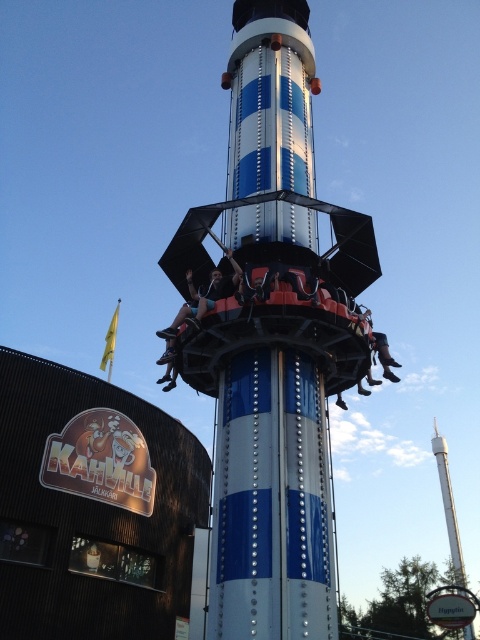
Question: Can you confirm if blue metallic tower at center is positioned to the left of metallic silver helmet at center?

Choices:
 (A) no
 (B) yes

Answer: (A)

Question: Considering the real-world distances, which object is closest to the metallic silver helmet at center?

Choices:
 (A) blue metallic tower at center
 (B) blue polished metal tower at center

Answer: (B)

Question: Where is blue metallic tower at center located in relation to metallic silver helmet at center in the image?

Choices:
 (A) above
 (B) below

Answer: (A)

Question: Which is nearer to the metallic silver helmet at center?

Choices:
 (A) leather boots at lower right
 (B) blue polished metal pole at center
 (C) blue polished metal tower at center
 (D) blue metallic tower at center

Answer: (C)

Question: Which of the following is the closest to the observer?

Choices:
 (A) blue metallic tower at center
 (B) blue polished metal pole at center
 (C) leather boots at lower right
 (D) metallic silver helmet at center

Answer: (B)

Question: Is blue polished metal pole at center bigger than leather boots at lower right?

Choices:
 (A) yes
 (B) no

Answer: (A)